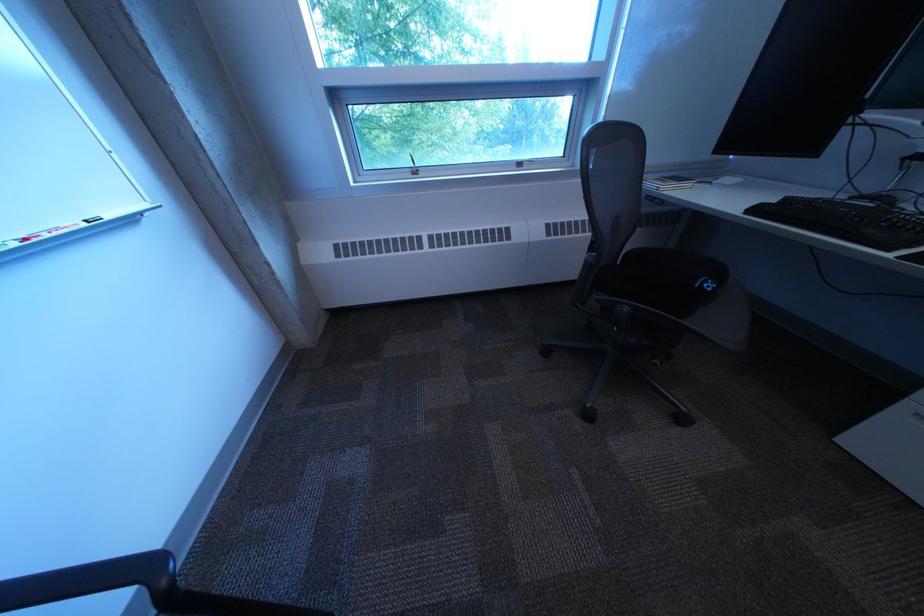
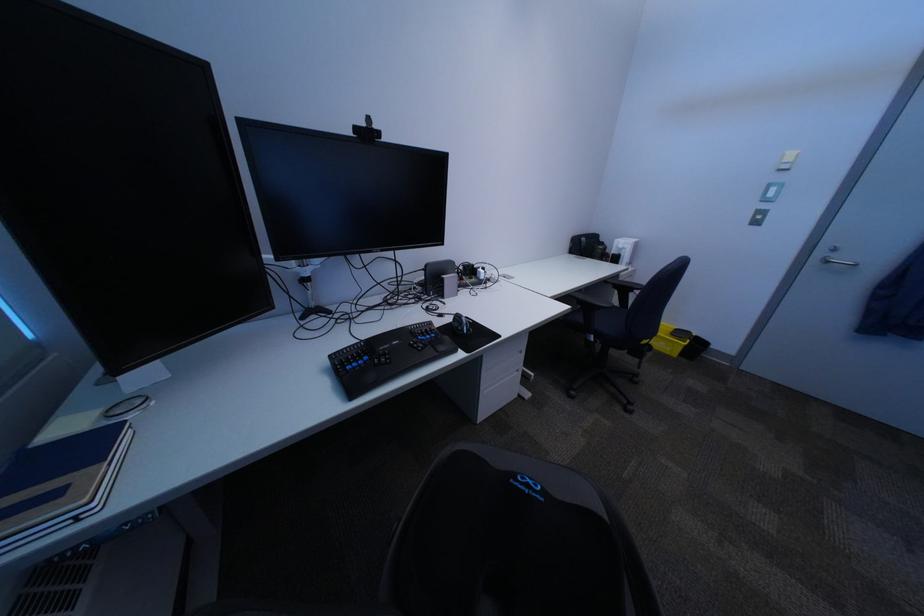
In the second image, find the point that corresponds to point 678,185 in the first image.

(101, 503)